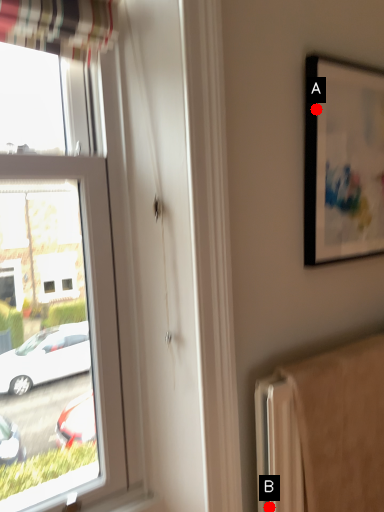
Question: Two points are circled on the image, labeled by A and B beside each circle. Among these points, which one is nearest to the camera?

Choices:
 (A) A is closer
 (B) B is closer

Answer: (B)